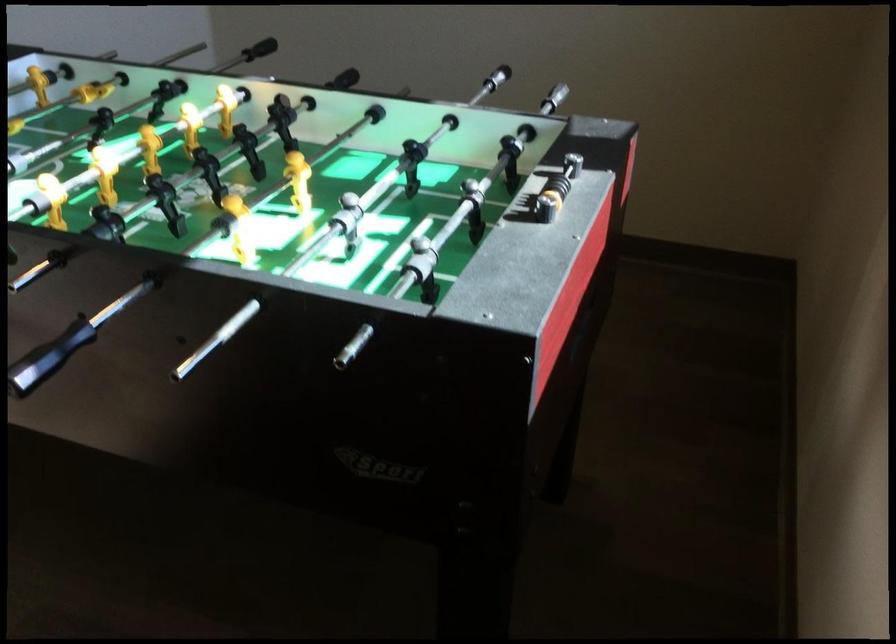
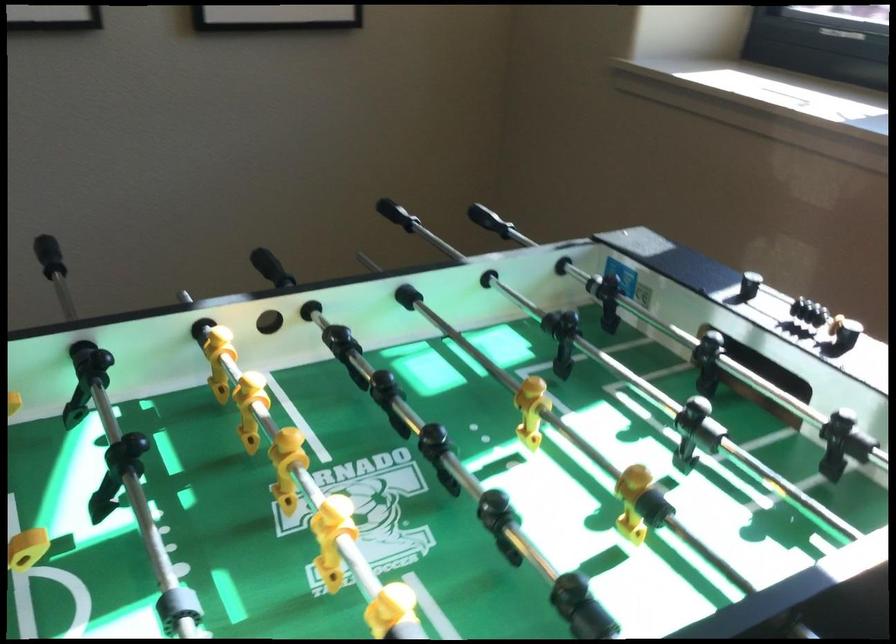
Where in the second image is the point corresponding to [803,160] from the first image?

(488, 220)